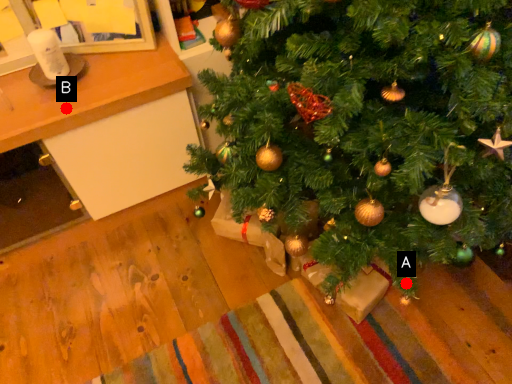
Question: Two points are circled on the image, labeled by A and B beside each circle. Which point appears farthest from the camera in this image?

Choices:
 (A) A is further
 (B) B is further

Answer: (B)